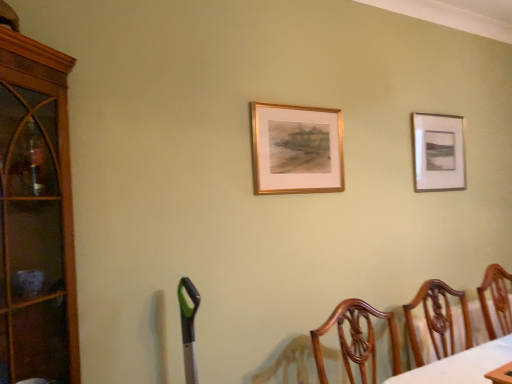
Question: Which direction should I rotate to face gold metallic picture frame at center, the first picture frame positioned from the front, — up or down?

Choices:
 (A) up
 (B) down

Answer: (A)

Question: Is gold metallic picture frame at center, which is the second picture frame in right-to-left order, located outside brown wood cabinet at left?

Choices:
 (A) yes
 (B) no

Answer: (A)

Question: Is gold metallic picture frame at center, the first picture frame positioned from the front, far away from brown wood cabinet at left?

Choices:
 (A) yes
 (B) no

Answer: (B)

Question: Is gold metallic picture frame at center, which ranks as the first picture frame in left-to-right order, beside brown wood cabinet at left?

Choices:
 (A) yes
 (B) no

Answer: (B)

Question: Is gold metallic picture frame at center, which is the second picture frame in right-to-left order, facing away from brown wood cabinet at left?

Choices:
 (A) no
 (B) yes

Answer: (A)

Question: Considering the relative sizes of gold metallic picture frame at center, which ranks as the first picture frame in left-to-right order, and brown wood cabinet at left in the image provided, is gold metallic picture frame at center, which ranks as the first picture frame in left-to-right order, shorter than brown wood cabinet at left?

Choices:
 (A) no
 (B) yes

Answer: (B)

Question: Considering the relative positions of gold metallic picture frame at center, which ranks as the first picture frame in left-to-right order, and brown wood cabinet at left in the image provided, is gold metallic picture frame at center, which ranks as the first picture frame in left-to-right order, to the left of brown wood cabinet at left from the viewer's perspective?

Choices:
 (A) no
 (B) yes

Answer: (A)

Question: Is wooden chair at lower right oriented away from brown wood cabinet at left?

Choices:
 (A) no
 (B) yes

Answer: (A)

Question: From the image's perspective, is wooden chair at lower right above brown wood cabinet at left?

Choices:
 (A) yes
 (B) no

Answer: (B)

Question: From the image's perspective, would you say wooden chair at lower right is shown under brown wood cabinet at left?

Choices:
 (A) no
 (B) yes

Answer: (B)

Question: Does wooden chair at lower right have a greater width compared to brown wood cabinet at left?

Choices:
 (A) no
 (B) yes

Answer: (A)

Question: Considering the relative sizes of wooden chair at lower right and brown wood cabinet at left in the image provided, is wooden chair at lower right thinner than brown wood cabinet at left?

Choices:
 (A) yes
 (B) no

Answer: (A)

Question: Is wooden chair at lower right touching brown wood cabinet at left?

Choices:
 (A) no
 (B) yes

Answer: (A)

Question: Can we say brown wood cabinet at left lies outside wooden chair at lower right?

Choices:
 (A) yes
 (B) no

Answer: (A)